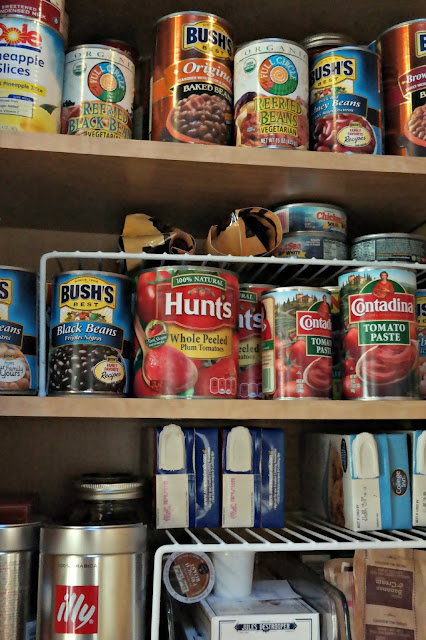
You are a GUI agent. You are given a task and a screenshot of the screen. Output one action in this format:
    pyautogui.click(x=<x>, y=<y>)
    Task: Click on the boxes or cartons or jars
    The image size is (426, 640).
    Given the screenshot: What is the action you would take?
    pyautogui.click(x=322, y=44), pyautogui.click(x=119, y=500), pyautogui.click(x=19, y=509), pyautogui.click(x=180, y=493), pyautogui.click(x=246, y=490), pyautogui.click(x=370, y=493), pyautogui.click(x=419, y=490), pyautogui.click(x=266, y=630), pyautogui.click(x=190, y=633)